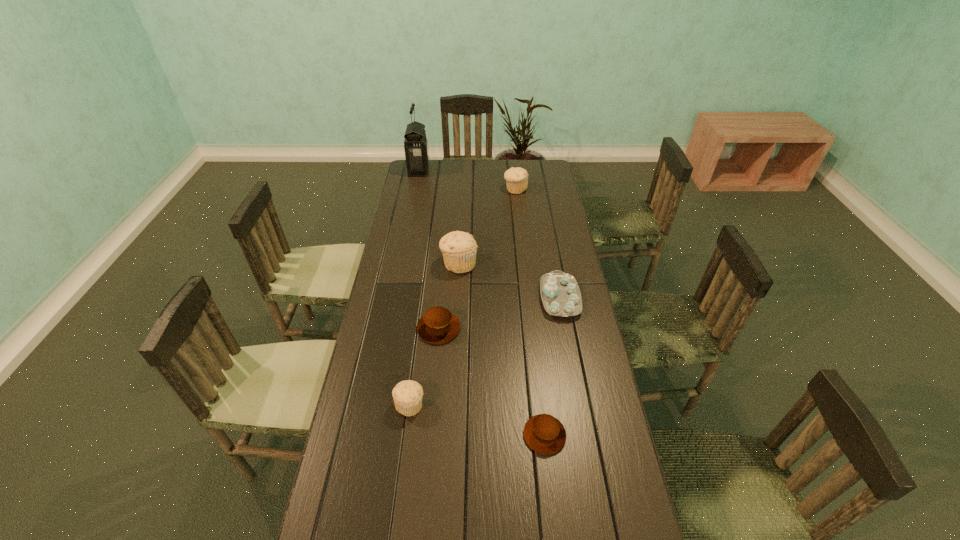
This screenshot has width=960, height=540. I want to click on lantern that is at the far edge, so click(416, 150).

The width and height of the screenshot is (960, 540). Find the location of `muffin present at the far edge`. muffin present at the far edge is located at coordinates (516, 178).

You are a GUI agent. You are given a task and a screenshot of the screen. Output one action in this format:
    pyautogui.click(x=<x>, y=<y>)
    Task: Click on the lantern that is at the left edge
    Image resolution: width=960 pixels, height=540 pixels.
    Given the screenshot: What is the action you would take?
    pyautogui.click(x=416, y=150)

At what (x,y) coordinates should I click in order to perform the action: click on muffin that is at the left edge. Please return your answer as a coordinate pair (x, y). This screenshot has height=540, width=960. Looking at the image, I should click on (407, 395).

You are a GUI agent. You are given a task and a screenshot of the screen. Output one action in this format:
    pyautogui.click(x=<x>, y=<y>)
    Task: Click on the chinaware at the right edge
    Image resolution: width=960 pixels, height=540 pixels.
    Given the screenshot: What is the action you would take?
    [x=560, y=293]

Where is `object present at the far left corner`? object present at the far left corner is located at coordinates (416, 150).

The image size is (960, 540). I want to click on object that is at the far right corner, so click(x=516, y=178).

Image resolution: width=960 pixels, height=540 pixels. I want to click on free space at the far edge of the desktop, so click(500, 164).

At what (x,y) coordinates should I click in order to perform the action: click on free space at the left edge of the desktop. Please return your answer as a coordinate pair (x, y). Looking at the image, I should click on (420, 278).

I want to click on vacant region at the right edge of the desktop, so click(568, 270).